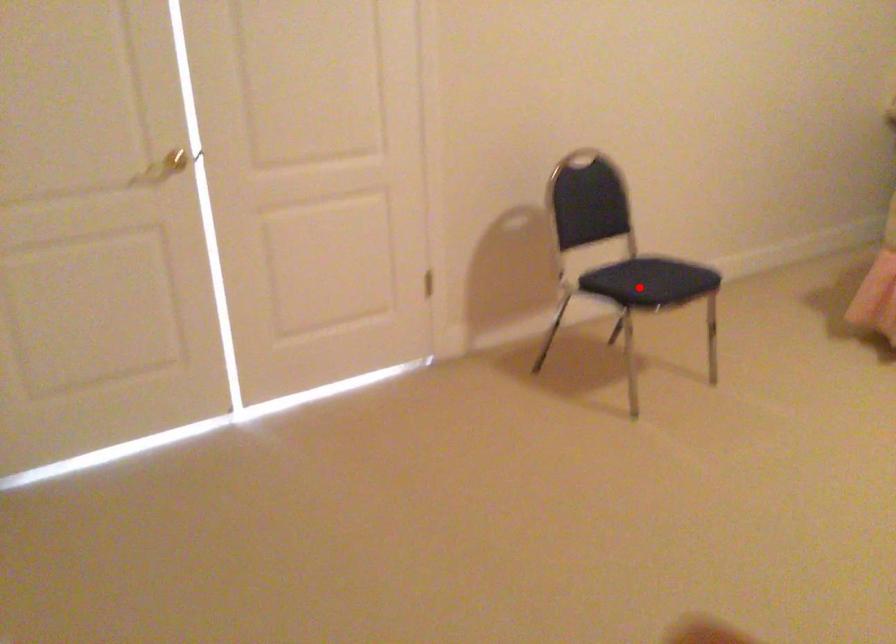
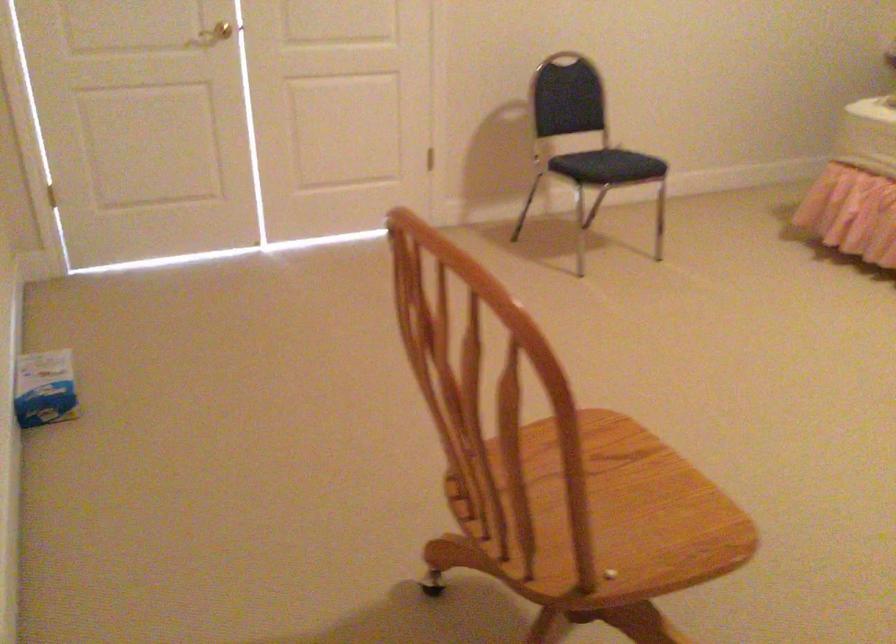
Question: I am providing you with two images of the same scene from different viewpoints. Image1 has a red point marked. In image2, the corresponding 3D location appears at what relative position? Reply with the corresponding letter.

Choices:
 (A) Closer
 (B) Farther

Answer: (B)